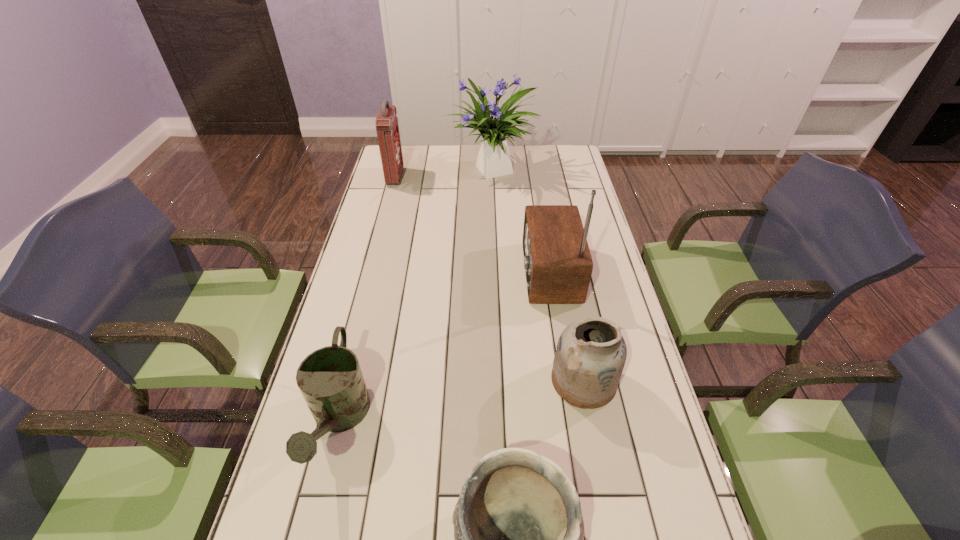
Where is `free space located on the left of the taller pottery`? This screenshot has width=960, height=540. free space located on the left of the taller pottery is located at coordinates point(405,381).

In order to click on flower arrangement that is positioned at the far edge in this screenshot , I will do `click(493, 160)`.

The height and width of the screenshot is (540, 960). Find the location of `the first-aid kit present at the far edge`. the first-aid kit present at the far edge is located at coordinates 387,128.

Locate an element on the screen. The height and width of the screenshot is (540, 960). the first-aid kit that is at the left edge is located at coordinates (387, 128).

This screenshot has height=540, width=960. I want to click on watering can that is at the left edge, so click(x=330, y=379).

Where is `radio receiver that is at the right edge`? radio receiver that is at the right edge is located at coordinates (558, 265).

Identify the location of pottery present at the right edge. (591, 353).

Locate an element on the screen. object located at the far left corner is located at coordinates (387, 128).

Where is `free location at the far edge`? The width and height of the screenshot is (960, 540). free location at the far edge is located at coordinates (525, 167).

Find the location of a particular element. vacant space at the left edge is located at coordinates (337, 474).